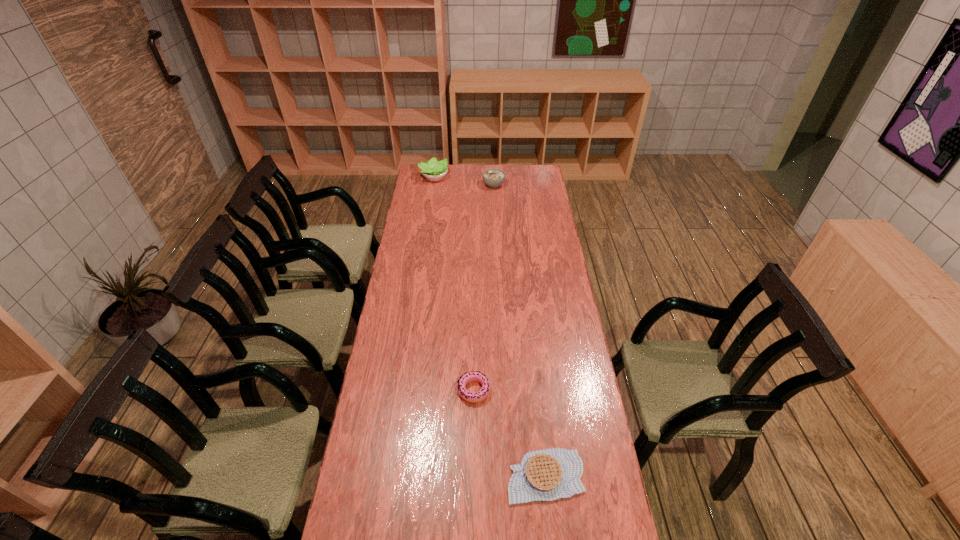
This screenshot has height=540, width=960. Identify the location of empty space that is in between the pie and the second nearest object. (510, 433).

Where is `vacant space in between the third shortest object and the leftmost object`? The image size is (960, 540). vacant space in between the third shortest object and the leftmost object is located at coordinates (464, 181).

You are a GUI agent. You are given a task and a screenshot of the screen. Output one action in this format:
    pyautogui.click(x=<x>, y=<y>)
    Task: Click on the vacant space that is in between the second tallest object and the second nearest object
    
    Given the screenshot: What is the action you would take?
    pyautogui.click(x=484, y=288)

Where is `empty space between the lettuce and the soup bowl`? empty space between the lettuce and the soup bowl is located at coordinates (464, 181).

This screenshot has height=540, width=960. In order to click on vacant area that lies between the leftmost object and the second nearest object in this screenshot , I will do `click(454, 284)`.

Find the location of a particular element. free space between the pie and the second tallest object is located at coordinates (519, 330).

Find the location of a particular element. free space between the soup bowl and the doughnut is located at coordinates (484, 288).

Identify which object is located as the second nearest to the lettuce. Please provide its 2D coordinates. Your answer should be formatted as a tuple, i.e. [(x, y)], where the tuple contains the x and y coordinates of a point satisfying the conditions above.

[(473, 397)]

Find the location of a particular element. object identified as the third closest to the leftmost object is located at coordinates (543, 475).

Where is `free space that satisfies the following two spatial constraints: 1. on the front side of the tallest object; 2. on the left side of the nearest object`? This screenshot has width=960, height=540. free space that satisfies the following two spatial constraints: 1. on the front side of the tallest object; 2. on the left side of the nearest object is located at coordinates (390, 476).